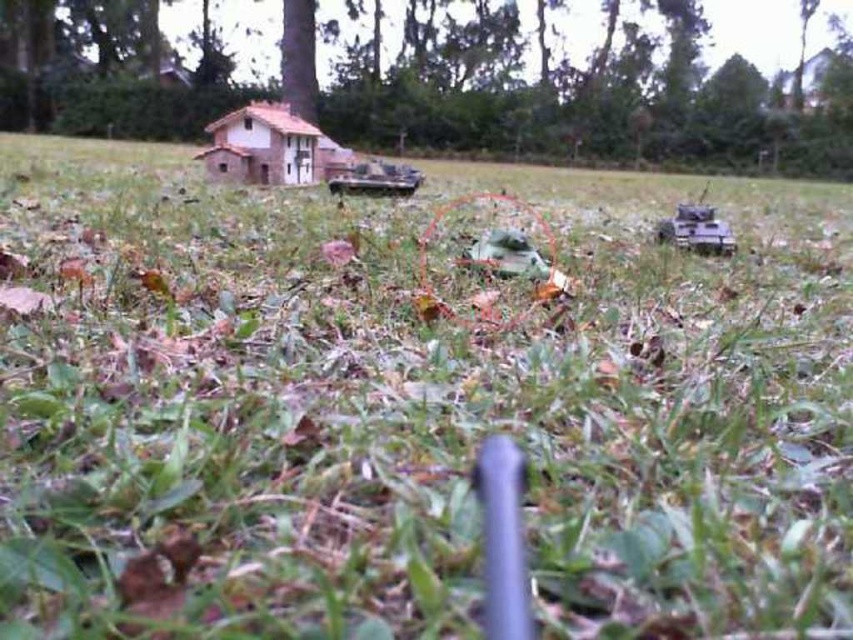
Question: Is brown wood tree at upper center closer to the viewer compared to purple matte tank at right?

Choices:
 (A) yes
 (B) no

Answer: (B)

Question: Among these objects, which one is nearest to the camera?

Choices:
 (A) brown wood tree at upper center
 (B) purple matte tank at right
 (C) metallic gray tank at center
 (D) green matte toy car at center

Answer: (D)

Question: Which of the following is the farthest from the observer?

Choices:
 (A) green matte toy car at center
 (B) brown wood tree at upper center
 (C) purple matte tank at right

Answer: (B)

Question: Is green matte tree at upper center wider than green matte toy car at center?

Choices:
 (A) no
 (B) yes

Answer: (B)

Question: Which object appears farthest from the camera in this image?

Choices:
 (A) purple matte tank at right
 (B) brown wood tree at upper center
 (C) metallic gray tank at center

Answer: (B)

Question: Does green matte tree at upper center have a larger size compared to metallic gray tank at center?

Choices:
 (A) yes
 (B) no

Answer: (A)